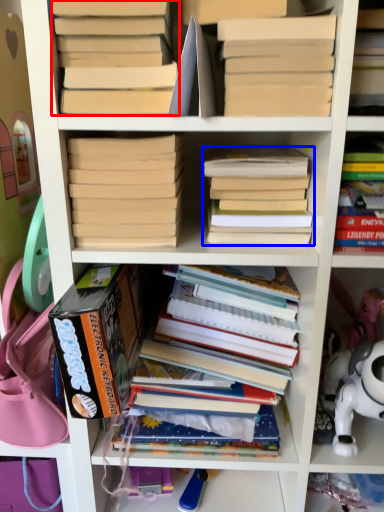
Question: Among these objects, which one is nearest to the camera, book (highlighted by a red box) or book (highlighted by a blue box)?

Choices:
 (A) book
 (B) book

Answer: (A)